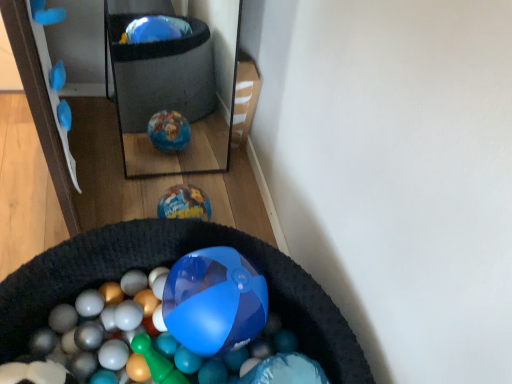
Image resolution: width=512 pixels, height=384 pixels. Identify the location of transparent blue beach ball at center. (220, 322).

Image resolution: width=512 pixels, height=384 pixels. Describe the element at coordinates (220, 322) in the screenshot. I see `transparent blue beach ball at center` at that location.

Locate an element on the screen. The image size is (512, 384). transparent blue beach ball at center is located at coordinates (220, 322).